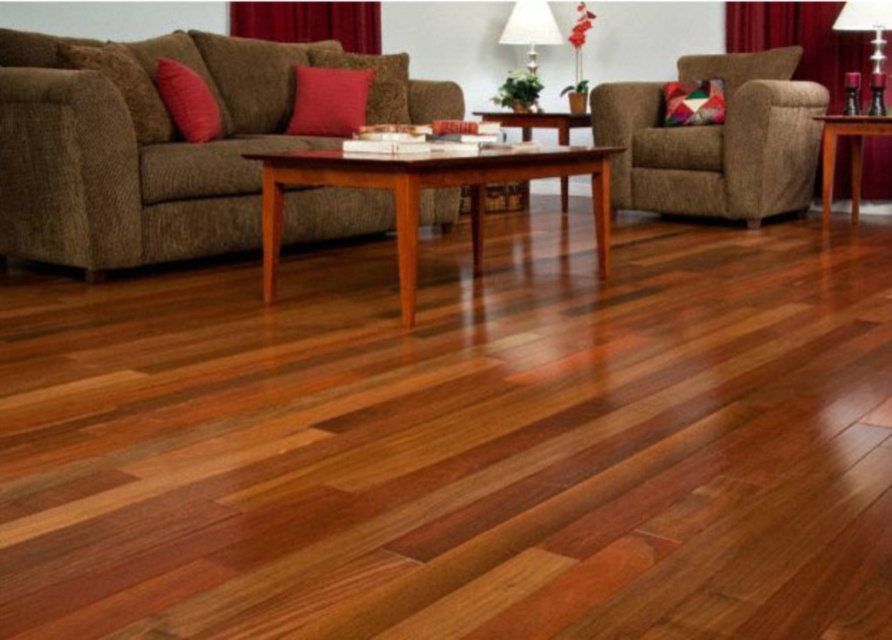
Question: Among these points, which one is nearest to the camera?

Choices:
 (A) (551, 164)
 (B) (670, 134)
 (C) (54, 214)

Answer: (A)

Question: Is brown textured armchair at right bigger than shiny brown wood coffee table at center?

Choices:
 (A) no
 (B) yes

Answer: (B)

Question: Can you confirm if brown fabric couch at upper left is smaller than shiny brown wood coffee table at center?

Choices:
 (A) no
 (B) yes

Answer: (A)

Question: Which object appears farthest from the camera in this image?

Choices:
 (A) brown fabric couch at upper left
 (B) brown textured armchair at right

Answer: (B)

Question: Which of these objects is positioned farthest from the brown textured armchair at right?

Choices:
 (A) brown fabric couch at upper left
 (B) shiny brown wood coffee table at center

Answer: (A)

Question: Does brown textured armchair at right appear on the left side of shiny brown wood coffee table at center?

Choices:
 (A) no
 (B) yes

Answer: (A)